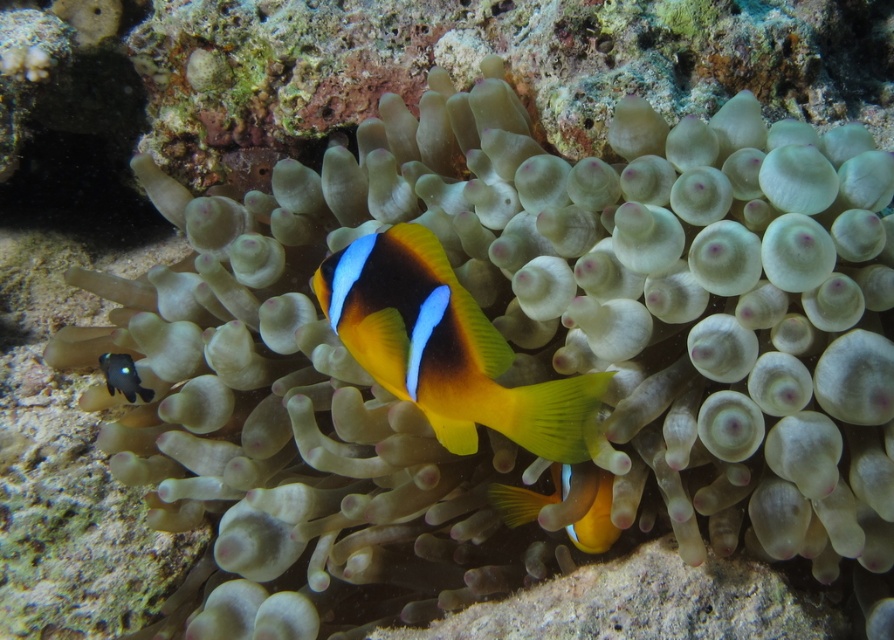
Question: Which of the following is the closest to the observer?

Choices:
 (A) shiny black rock at lower left
 (B) shiny orange clownfish at center

Answer: (B)

Question: Which object is farther from the camera taking this photo?

Choices:
 (A) shiny black rock at lower left
 (B) shiny orange clownfish at center

Answer: (A)

Question: Does yellow matte clownfish at center have a smaller size compared to shiny black rock at lower left?

Choices:
 (A) yes
 (B) no

Answer: (B)

Question: Estimate the real-world distances between objects in this image. Which object is farther from the yellow matte clownfish at center?

Choices:
 (A) shiny orange clownfish at center
 (B) shiny black rock at lower left

Answer: (B)

Question: Is yellow matte clownfish at center wider than shiny black rock at lower left?

Choices:
 (A) yes
 (B) no

Answer: (A)

Question: Is shiny orange clownfish at center bigger than shiny black rock at lower left?

Choices:
 (A) no
 (B) yes

Answer: (B)